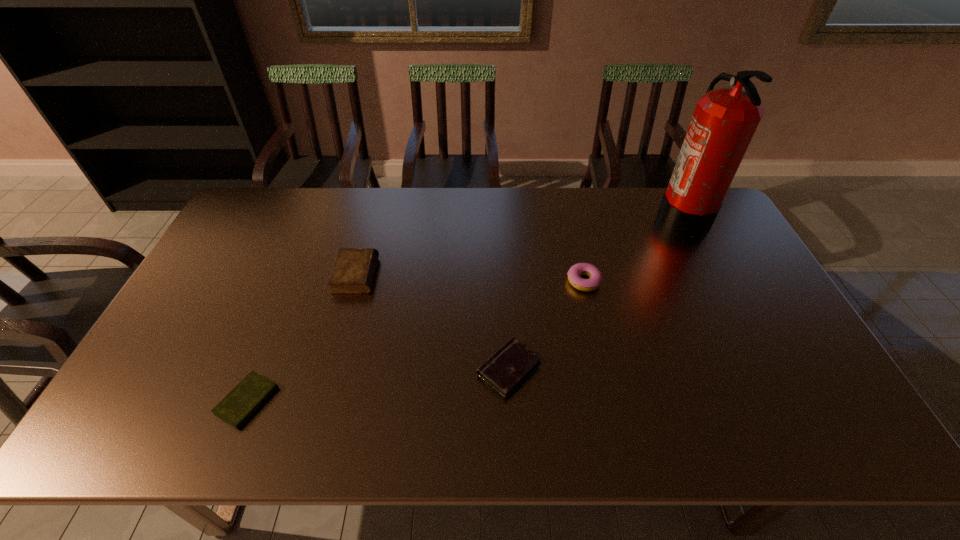
Identify the location of the farthest object. The image size is (960, 540). (724, 121).

The image size is (960, 540). Identify the location of the rightmost object. (724, 121).

Locate an element on the screen. the second diary from right to left is located at coordinates (353, 271).

Identify the location of the second object from left to right. (353, 271).

Where is `doughnut`? The width and height of the screenshot is (960, 540). doughnut is located at coordinates (574, 274).

Locate an element on the screen. the rightmost diary is located at coordinates (507, 368).

This screenshot has width=960, height=540. I want to click on the second tallest diary, so click(x=507, y=368).

Find the location of a particular element. the leftmost diary is located at coordinates (241, 403).

At what (x,y) coordinates should I click in order to perform the action: click on the leftmost object. Please return your answer as a coordinate pair (x, y). Image resolution: width=960 pixels, height=540 pixels. Looking at the image, I should click on (241, 403).

This screenshot has height=540, width=960. Identify the location of blank space located 0.340m on the front side of the tallest object. (562, 215).